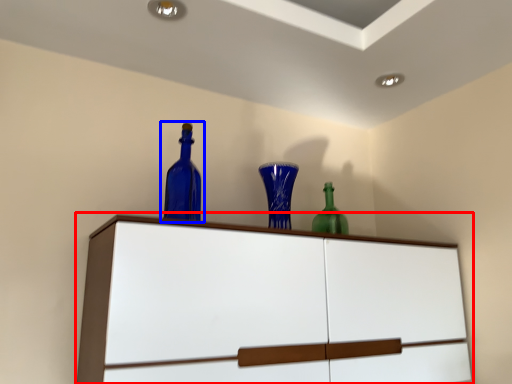
Question: Which object appears closest to the camera in this image, cupboard (highlighted by a red box) or bottle (highlighted by a blue box)?

Choices:
 (A) cupboard
 (B) bottle

Answer: (A)